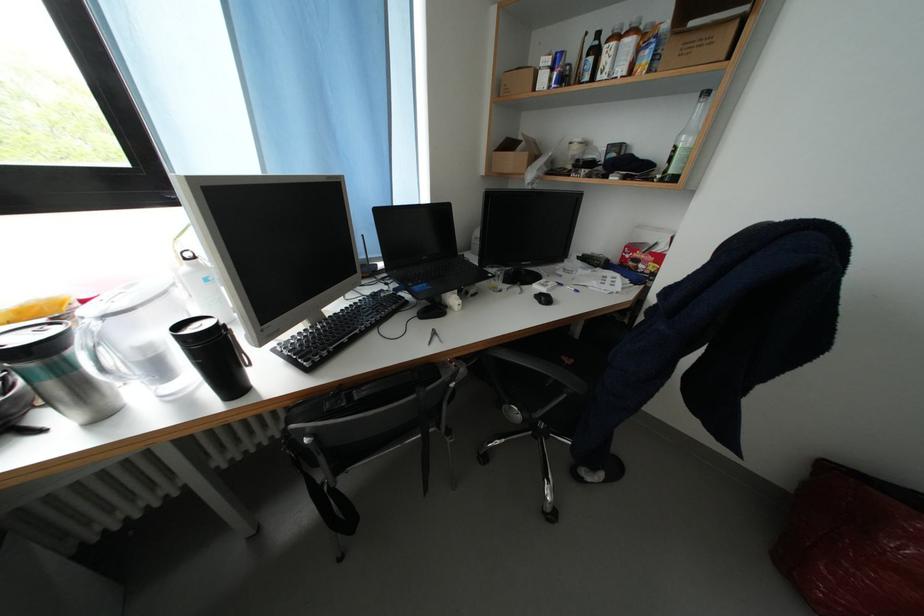
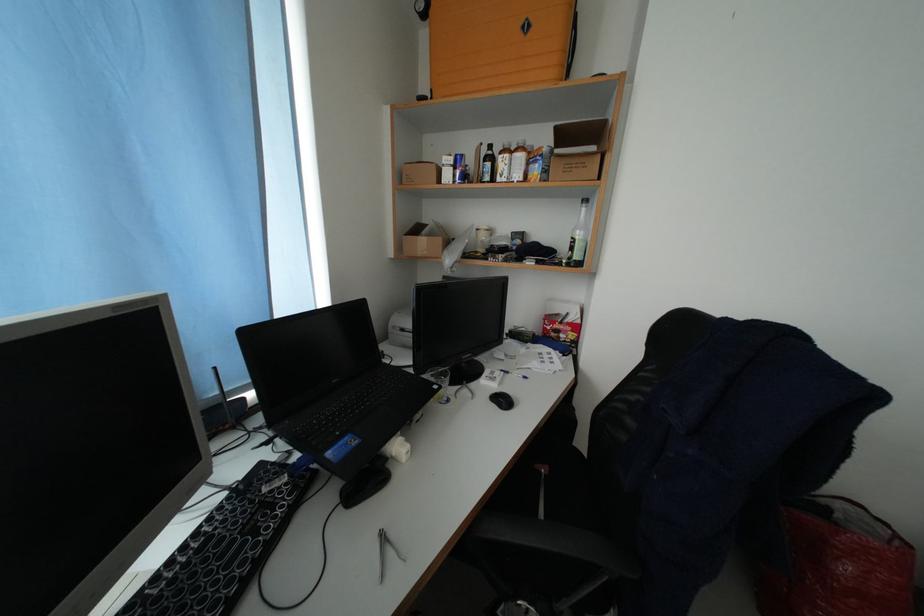
Question: The camera is either moving clockwise (left) or counter-clockwise (right) around the object. The first image is from the beginning of the video and the second image is from the end. Is the camera moving left or right when shooting the video?

Choices:
 (A) Left
 (B) Right

Answer: (A)